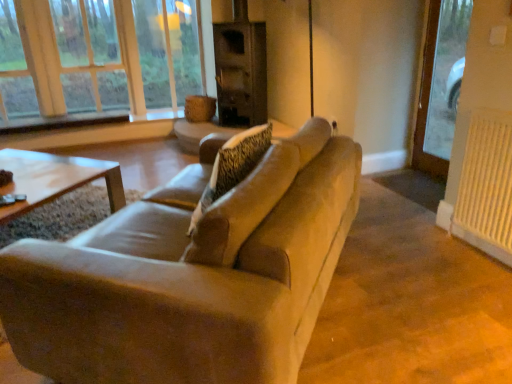
Question: Can you confirm if white textured radiator at right is positioned to the left of wooden frame at upper left?

Choices:
 (A) yes
 (B) no

Answer: (B)

Question: Is wooden frame at upper left at the back of white textured radiator at right?

Choices:
 (A) yes
 (B) no

Answer: (B)

Question: Is the position of white textured radiator at right less distant than that of wooden frame at upper left?

Choices:
 (A) yes
 (B) no

Answer: (A)

Question: Considering the relative sizes of white textured radiator at right and wooden frame at upper left in the image provided, is white textured radiator at right wider than wooden frame at upper left?

Choices:
 (A) yes
 (B) no

Answer: (B)

Question: Is wooden frame at upper left located within white textured radiator at right?

Choices:
 (A) yes
 (B) no

Answer: (B)

Question: From the image's perspective, is white textured radiator at right located beneath wooden frame at upper left?

Choices:
 (A) yes
 (B) no

Answer: (A)

Question: Can you confirm if white textured radiator at right is smaller than beige fabric couch at center?

Choices:
 (A) no
 (B) yes

Answer: (B)

Question: Can you confirm if white textured radiator at right is wider than beige fabric couch at center?

Choices:
 (A) yes
 (B) no

Answer: (B)

Question: Considering the relative sizes of white textured radiator at right and beige fabric couch at center in the image provided, is white textured radiator at right thinner than beige fabric couch at center?

Choices:
 (A) no
 (B) yes

Answer: (B)

Question: From the image's perspective, is white textured radiator at right on beige fabric couch at center?

Choices:
 (A) no
 (B) yes

Answer: (B)

Question: Can we say white textured radiator at right lies outside beige fabric couch at center?

Choices:
 (A) no
 (B) yes

Answer: (B)

Question: From a real-world perspective, is white textured radiator at right located beneath beige fabric couch at center?

Choices:
 (A) no
 (B) yes

Answer: (B)

Question: From the image's perspective, is beige fabric couch at center beneath white textured radiator at right?

Choices:
 (A) yes
 (B) no

Answer: (A)